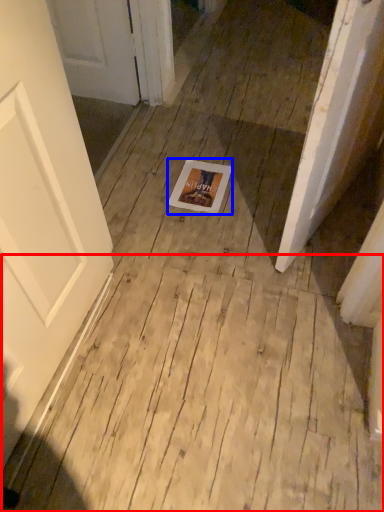
Question: Among these objects, which one is nearest to the camera, plywood (highlighted by a red box) or postcard (highlighted by a blue box)?

Choices:
 (A) plywood
 (B) postcard

Answer: (A)